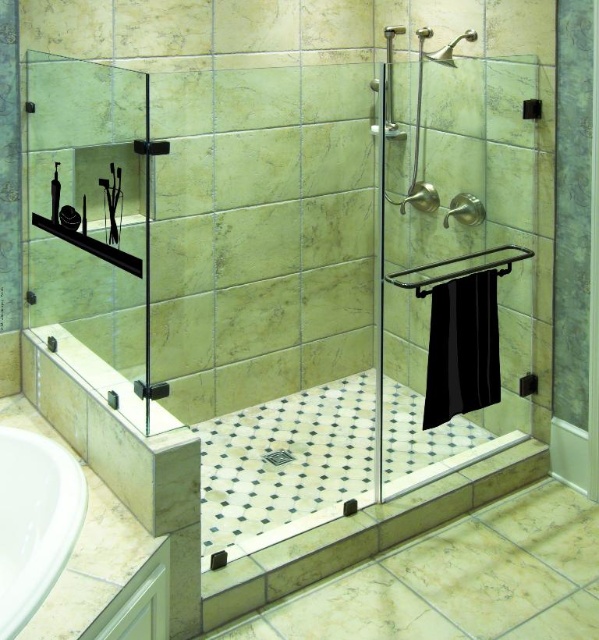
Is clear glass shower door at right to the left of satin nickel showerhead at upper center from the viewer's perspective?

Indeed, clear glass shower door at right is positioned on the left side of satin nickel showerhead at upper center.

Between clear glass shower door at right and satin nickel showerhead at upper center, which one is positioned lower?

clear glass shower door at right is lower down.

Who is more forward, [489,426] or [465,36]?

Positioned in front is point [465,36].

Locate an element on the screen. The image size is (599, 640). clear glass shower door at right is located at coordinates 458,260.

Can you confirm if white ceramic bathtub at lower left is positioned above white glossy screen door at lower left?

Yes.

Can you confirm if white ceramic bathtub at lower left is positioned below white glossy screen door at lower left?

No, white ceramic bathtub at lower left is not below white glossy screen door at lower left.

You are a GUI agent. You are given a task and a screenshot of the screen. Output one action in this format:
    pyautogui.click(x=<x>, y=<y>)
    Task: Click on the white ceramic bathtub at lower left
    This screenshot has height=640, width=599.
    Given the screenshot: What is the action you would take?
    pyautogui.click(x=34, y=522)

Who is more distant from viewer, (x=467, y=29) or (x=394, y=134)?

The point (x=394, y=134) is more distant.

What do you see at coordinates (449, 49) in the screenshot?
I see `satin nickel showerhead at upper center` at bounding box center [449, 49].

This screenshot has height=640, width=599. Find the location of `satin nickel showerhead at upper center`. satin nickel showerhead at upper center is located at coordinates (449, 49).